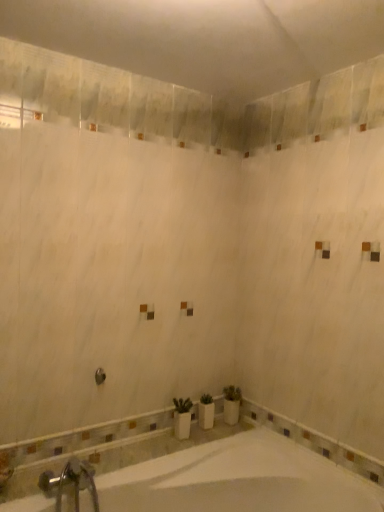
Question: From the image's perspective, would you say silver metallic faucet at lower left is positioned over white glossy bathtub at lower center?

Choices:
 (A) yes
 (B) no

Answer: (A)

Question: Is silver metallic faucet at lower left beside white glossy bathtub at lower center?

Choices:
 (A) no
 (B) yes

Answer: (A)

Question: Is silver metallic faucet at lower left wider than white glossy bathtub at lower center?

Choices:
 (A) no
 (B) yes

Answer: (A)

Question: Is silver metallic faucet at lower left facing away from white glossy bathtub at lower center?

Choices:
 (A) no
 (B) yes

Answer: (B)

Question: Can you confirm if silver metallic faucet at lower left is shorter than white glossy bathtub at lower center?

Choices:
 (A) no
 (B) yes

Answer: (B)

Question: Considering the positions of white glossy bathtub at lower center and brushed metal showerhead at center in the image, is white glossy bathtub at lower center bigger or smaller than brushed metal showerhead at center?

Choices:
 (A) big
 (B) small

Answer: (A)

Question: Is white glossy bathtub at lower center in front of or behind brushed metal showerhead at center in the image?

Choices:
 (A) behind
 (B) front

Answer: (B)

Question: Would you say white glossy bathtub at lower center is to the left or to the right of brushed metal showerhead at center in the picture?

Choices:
 (A) left
 (B) right

Answer: (B)

Question: Is white glossy bathtub at lower center wider or thinner than brushed metal showerhead at center?

Choices:
 (A) wide
 (B) thin

Answer: (A)

Question: Do you think silver metallic faucet at lower left is within brushed metal showerhead at center, or outside of it?

Choices:
 (A) outside
 (B) inside

Answer: (A)

Question: Is silver metallic faucet at lower left taller or shorter than brushed metal showerhead at center?

Choices:
 (A) tall
 (B) short

Answer: (A)

Question: Visually, is silver metallic faucet at lower left positioned to the left or to the right of brushed metal showerhead at center?

Choices:
 (A) left
 (B) right

Answer: (A)

Question: Does point (61, 498) appear closer or farther from the camera than point (94, 372)?

Choices:
 (A) farther
 (B) closer

Answer: (B)

Question: Considering their positions, is brushed metal showerhead at center located in front of or behind white glossy bathtub at lower center?

Choices:
 (A) behind
 (B) front

Answer: (A)

Question: In terms of width, does brushed metal showerhead at center look wider or thinner when compared to white glossy bathtub at lower center?

Choices:
 (A) wide
 (B) thin

Answer: (B)